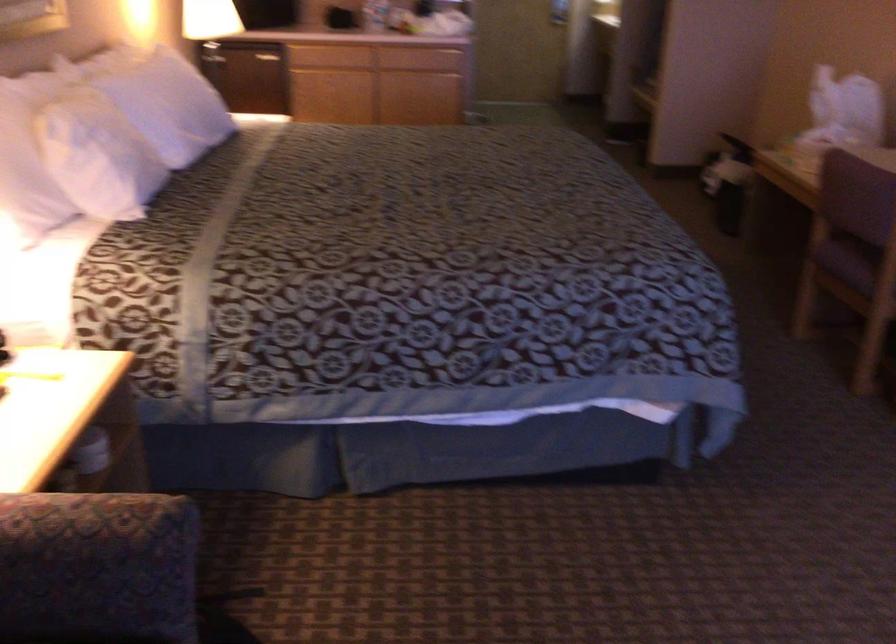
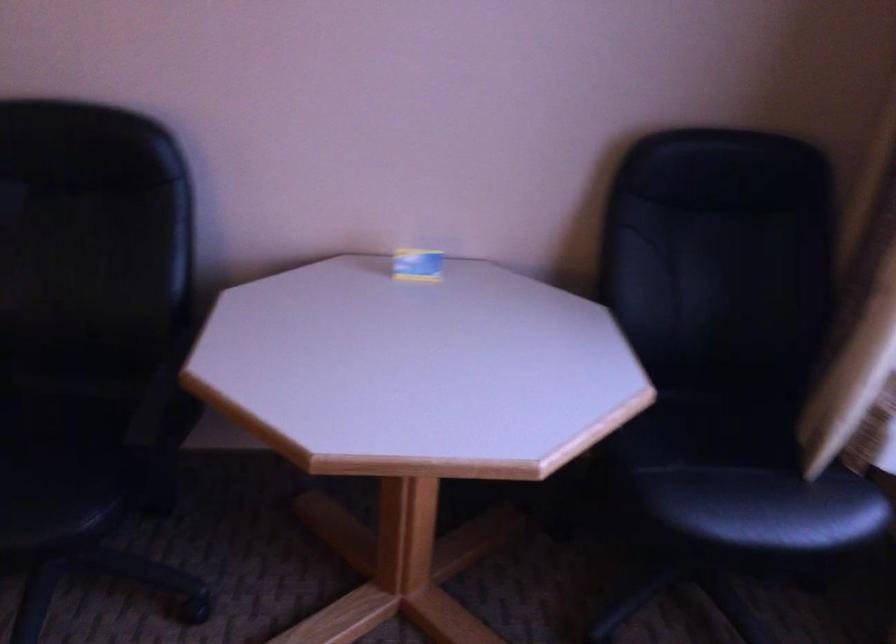
First-person continuous shooting, in which direction is the camera rotating?

The camera's rotation is toward right-down.